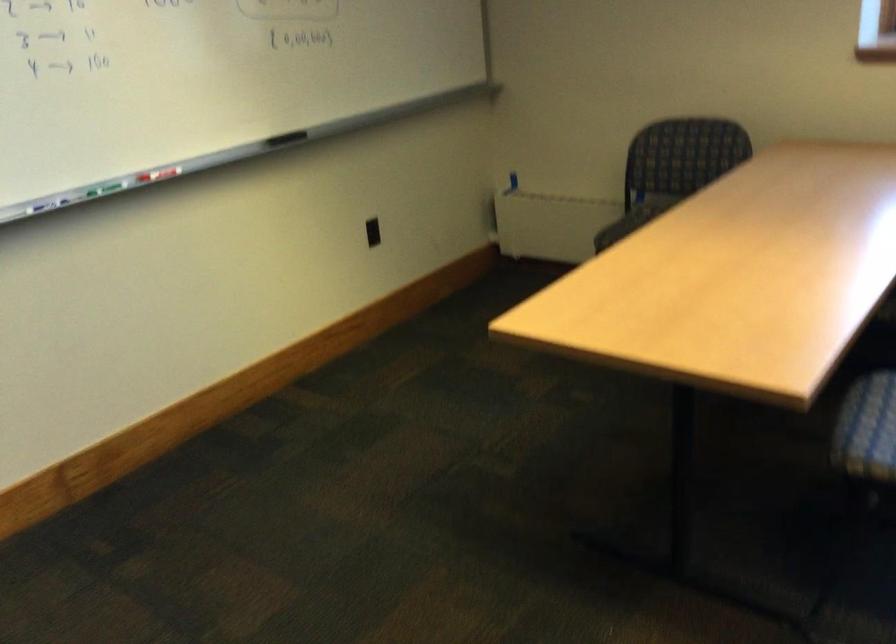
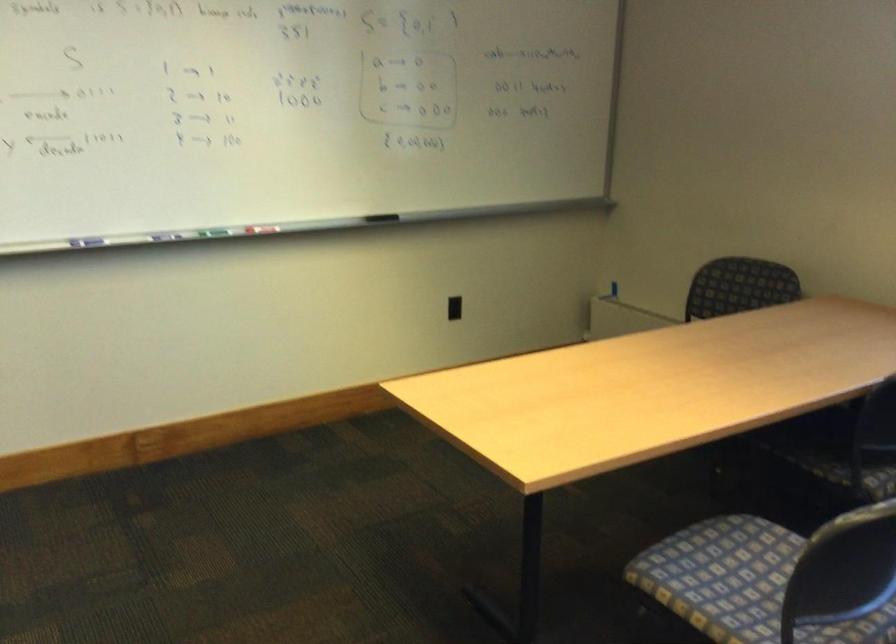
Where in the second image is the point corresponding to [375,232] from the first image?

(453, 308)